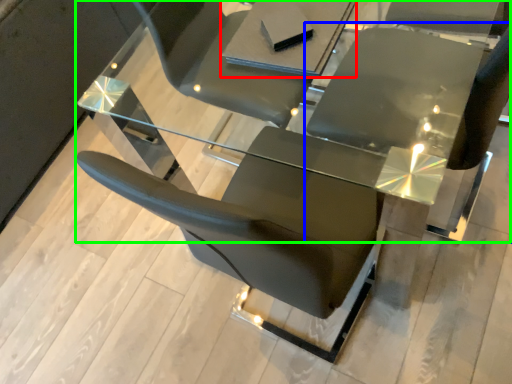
Question: Based on their relative distances, which object is nearer to table (highlighted by a red box)? Choose from chair (highlighted by a blue box) and table (highlighted by a green box).

Choices:
 (A) chair
 (B) table

Answer: (B)